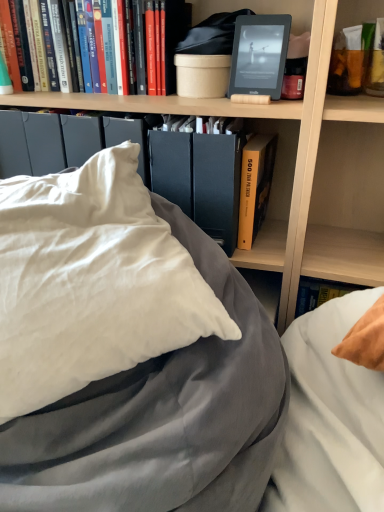
Question: Is hardcover book at upper left, arranged as the 1th book when viewed from the left, next to wooden bookshelf at upper center?

Choices:
 (A) no
 (B) yes

Answer: (A)

Question: Is hardcover book at upper left, the third book when ordered from bottom to top, further to the viewer compared to wooden bookshelf at upper center?

Choices:
 (A) no
 (B) yes

Answer: (B)

Question: Considering the relative sizes of hardcover book at upper left, acting as the third book starting from the right, and wooden bookshelf at upper center in the image provided, is hardcover book at upper left, acting as the third book starting from the right, thinner than wooden bookshelf at upper center?

Choices:
 (A) no
 (B) yes

Answer: (B)

Question: Considering the relative sizes of hardcover book at upper left, arranged as the 1th book when viewed from the left, and wooden bookshelf at upper center in the image provided, is hardcover book at upper left, arranged as the 1th book when viewed from the left, wider than wooden bookshelf at upper center?

Choices:
 (A) no
 (B) yes

Answer: (A)

Question: Considering the relative positions of hardcover book at upper left, acting as the third book starting from the right, and wooden bookshelf at upper center in the image provided, is hardcover book at upper left, acting as the third book starting from the right, to the left of wooden bookshelf at upper center from the viewer's perspective?

Choices:
 (A) yes
 (B) no

Answer: (A)

Question: In terms of size, does wooden bookshelf at upper center appear bigger or smaller than hardcover book at upper left, arranged as the 1th book when viewed from the left?

Choices:
 (A) big
 (B) small

Answer: (A)

Question: Is point (322, 236) closer or farther from the camera than point (38, 83)?

Choices:
 (A) farther
 (B) closer

Answer: (A)

Question: From a real-world perspective, is wooden bookshelf at upper center positioned above or below hardcover book at upper left, acting as the third book starting from the right?

Choices:
 (A) below
 (B) above

Answer: (A)

Question: In terms of height, does wooden bookshelf at upper center look taller or shorter compared to hardcover book at upper left, which is counted as the first book, starting from the top?

Choices:
 (A) short
 (B) tall

Answer: (B)

Question: Based on their positions, is yellow hardcover book at center, the 2th book from the right, located to the left or right of matte orange tube at upper right, the first book in the right-to-left sequence?

Choices:
 (A) left
 (B) right

Answer: (A)

Question: Does point (263, 182) appear closer or farther from the camera than point (364, 78)?

Choices:
 (A) farther
 (B) closer

Answer: (A)

Question: From the image's perspective, relative to matte orange tube at upper right, which appears as the second book when viewed from the top, is yellow hardcover book at center, the 3th book when ordered from top to bottom, above or below?

Choices:
 (A) below
 (B) above

Answer: (A)

Question: From a real-world perspective, is yellow hardcover book at center, the 2th book from the right, above or below matte orange tube at upper right, the first book in the right-to-left sequence?

Choices:
 (A) above
 (B) below

Answer: (B)

Question: Is matte black kindle at upper center, which is the 2th paperback book in bottom-to-top order, in front of or behind matte orange tube at upper right, marked as the second book in a bottom-to-top arrangement, in the image?

Choices:
 (A) behind
 (B) front

Answer: (B)

Question: Considering the positions of point (281, 48) and point (349, 35), is point (281, 48) closer or farther from the camera than point (349, 35)?

Choices:
 (A) closer
 (B) farther

Answer: (A)